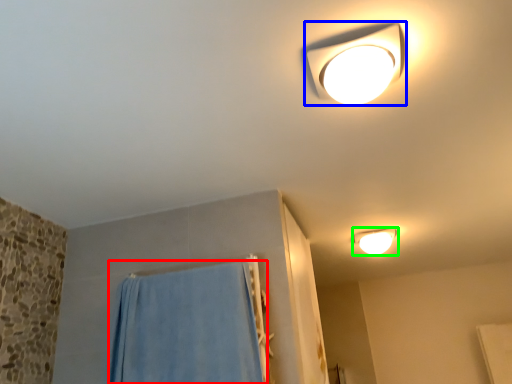
Question: Estimate the real-world distances between objects in this image. Which object is closer to curtain (highlighted by a red box), lamp (highlighted by a blue box) or lamp (highlighted by a green box)?

Choices:
 (A) lamp
 (B) lamp

Answer: (A)